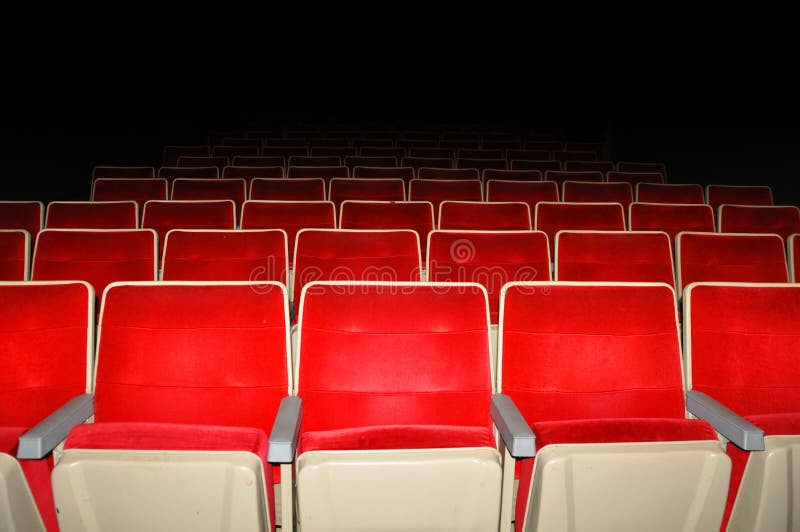
At what (x,y) coordinates should I click in order to perform the action: click on bottom of seats folded up. Please return your answer as a coordinate pair (x, y). The width and height of the screenshot is (800, 532). Looking at the image, I should click on (5, 511), (113, 495), (360, 502), (613, 468), (770, 507).